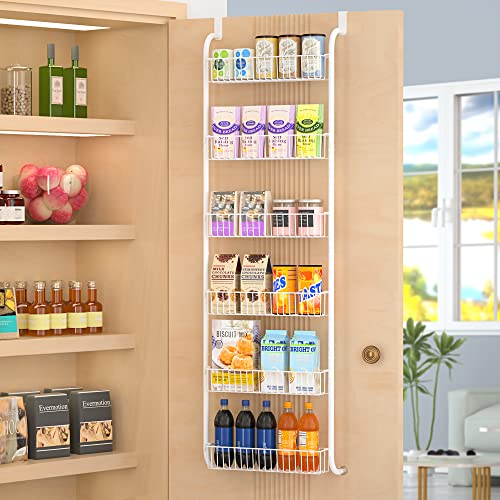
Image resolution: width=500 pixels, height=500 pixels. Find the location of `window pane`. window pane is located at coordinates (419, 263), (418, 223), (416, 144), (479, 133), (477, 221), (476, 263), (498, 253), (499, 226), (495, 145).